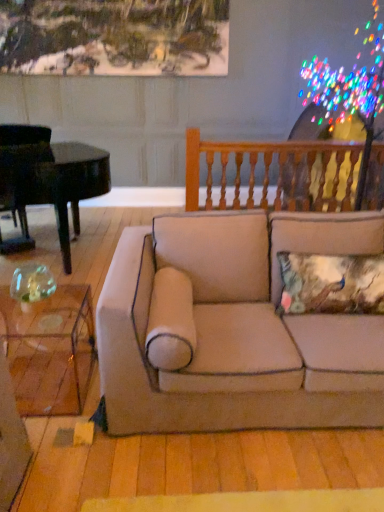
At what (x,y) coordinates should I click in order to perform the action: click on transparent glass coffee table at lower left. Please return your answer as a coordinate pair (x, y). Looking at the image, I should click on (50, 350).

Describe the element at coordinates (268, 172) in the screenshot. The image size is (384, 512). I see `wooden balusters at upper right` at that location.

Locate an element on the screen. The image size is (384, 512). beige fabric couch at center is located at coordinates (233, 328).

Between transparent glass coffee table at lower left and black polished piano at left, which one appears on the right side from the viewer's perspective?

transparent glass coffee table at lower left is more to the right.

From a real-world perspective, is transparent glass coffee table at lower left on black polished piano at left?

Incorrect, from a real-world perspective, transparent glass coffee table at lower left is lower than black polished piano at left.

Is transparent glass coffee table at lower left directly adjacent to black polished piano at left?

There is a gap between transparent glass coffee table at lower left and black polished piano at left.

Does transparent glass coffee table at lower left contain black polished piano at left?

That's incorrect, black polished piano at left is not inside transparent glass coffee table at lower left.

From the image's perspective, between black polished piano at left and transparent glass coffee table at lower left, which one is located above?

black polished piano at left.

Is point (100, 179) farther from viewer compared to point (50, 381)?

That is True.

From a real-world perspective, which object stands above the other?

black polished piano at left.

Which is behind, black polished piano at left or transparent glass coffee table at lower left?

black polished piano at left.

Measure the distance from textured floral pillow at center to black polished piano at left.

They are 7.12 feet apart.

From a real-world perspective, is textured floral pillow at center beneath black polished piano at left?

Yes.

Does textured floral pillow at center lie in front of black polished piano at left?

Yes, it is in front of black polished piano at left.

Between textured floral pillow at center and black polished piano at left, which one has less height?

textured floral pillow at center is shorter.

From the image's perspective, between beige fabric couch at center and wooden balusters at upper right, which one is located above?

wooden balusters at upper right is shown above in the image.

At what (x,y) coordinates should I click in order to perform the action: click on studio couch on the left side of wooden balusters at upper right. Please return your answer as a coordinate pair (x, y). Looking at the image, I should click on (233, 328).

Visually, is beige fabric couch at center positioned to the left or to the right of wooden balusters at upper right?

From the image, it's evident that beige fabric couch at center is to the left of wooden balusters at upper right.

Between transparent glass coffee table at lower left and wooden balusters at upper right, which one has larger width?

With larger width is transparent glass coffee table at lower left.

From a real-world perspective, does transparent glass coffee table at lower left stand above wooden balusters at upper right?

No, from a real-world perspective, transparent glass coffee table at lower left is not above wooden balusters at upper right.

The image size is (384, 512). In order to click on rail that appears above the black polished piano at left (from the image's perspective) in this screenshot , I will do [x=268, y=172].

In the scene shown: Is black polished piano at left a part of wooden balusters at upper right?

That's incorrect, black polished piano at left is not inside wooden balusters at upper right.

From a real-world perspective, is wooden balusters at upper right under black polished piano at left?

No, from a real-world perspective, wooden balusters at upper right is not below black polished piano at left.

From the image's perspective, would you say wooden balusters at upper right is shown under black polished piano at left?

No, from the image's perspective, wooden balusters at upper right is not beneath black polished piano at left.

In the image, is wooden balusters at upper right on the left side or the right side of beige fabric couch at center?

Based on their positions, wooden balusters at upper right is located to the right of beige fabric couch at center.

Does point (374, 207) lie behind point (255, 401)?

That is True.

Consider the image. Looking at the image, does wooden balusters at upper right seem bigger or smaller compared to beige fabric couch at center?

Clearly, wooden balusters at upper right is smaller in size than beige fabric couch at center.

From the image's perspective, is wooden balusters at upper right located beneath beige fabric couch at center?

No.

Find the location of a particular element. The width and height of the screenshot is (384, 512). coffee table in front of the black polished piano at left is located at coordinates (50, 350).

At what (x,y) coordinates should I click in order to perform the action: click on coffee table below the black polished piano at left (from the image's perspective). Please return your answer as a coordinate pair (x, y). Image resolution: width=384 pixels, height=512 pixels. Looking at the image, I should click on (50, 350).

Considering their positions, is transparent glass coffee table at lower left positioned closer to wooden balusters at upper right than textured floral pillow at center?

The object closer to wooden balusters at upper right is textured floral pillow at center.

Based on their spatial positions, is beige fabric couch at center or wooden balusters at upper right closer to textured floral pillow at center?

beige fabric couch at center is positioned closer to the anchor textured floral pillow at center.

Consider the image. Which object lies nearer to the anchor point wooden balusters at upper right, beige fabric couch at center or textured floral pillow at center?

Based on the image, beige fabric couch at center appears to be nearer to wooden balusters at upper right.

Which object lies nearer to the anchor point beige fabric couch at center, transparent glass coffee table at lower left or wooden balusters at upper right?

transparent glass coffee table at lower left lies closer to beige fabric couch at center than the other object.

Looking at the image, which one is located further to black polished piano at left, transparent glass coffee table at lower left or beige fabric couch at center?

beige fabric couch at center is further to black polished piano at left.

When comparing their distances from transparent glass coffee table at lower left, does beige fabric couch at center or black polished piano at left seem closer?

beige fabric couch at center.

Estimate the real-world distances between objects in this image. Which object is further from beige fabric couch at center, textured floral pillow at center or transparent glass coffee table at lower left?

transparent glass coffee table at lower left is positioned further to the anchor beige fabric couch at center.

Considering their positions, is beige fabric couch at center positioned closer to wooden balusters at upper right than black polished piano at left?

Based on the image, black polished piano at left appears to be nearer to wooden balusters at upper right.

Where is `coffee table situated between black polished piano at left and beige fabric couch at center from left to right`? This screenshot has height=512, width=384. coffee table situated between black polished piano at left and beige fabric couch at center from left to right is located at coordinates (50, 350).

The height and width of the screenshot is (512, 384). I want to click on pillow located between black polished piano at left and wooden balusters at upper right in the left-right direction, so click(x=331, y=284).

The height and width of the screenshot is (512, 384). I want to click on studio couch located between transparent glass coffee table at lower left and textured floral pillow at center in the left-right direction, so 233,328.

The width and height of the screenshot is (384, 512). Identify the location of coffee table located between black polished piano at left and wooden balusters at upper right in the left-right direction. (50, 350).